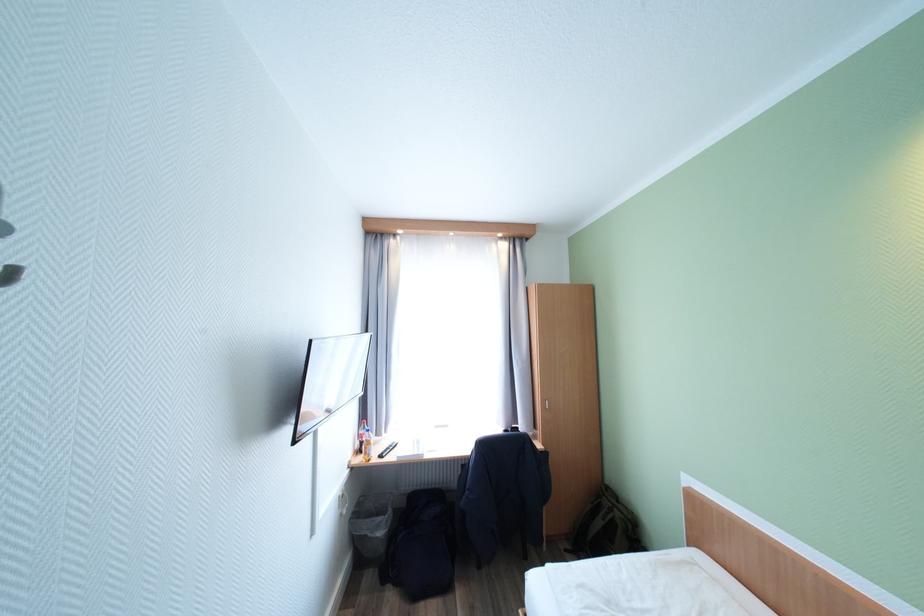
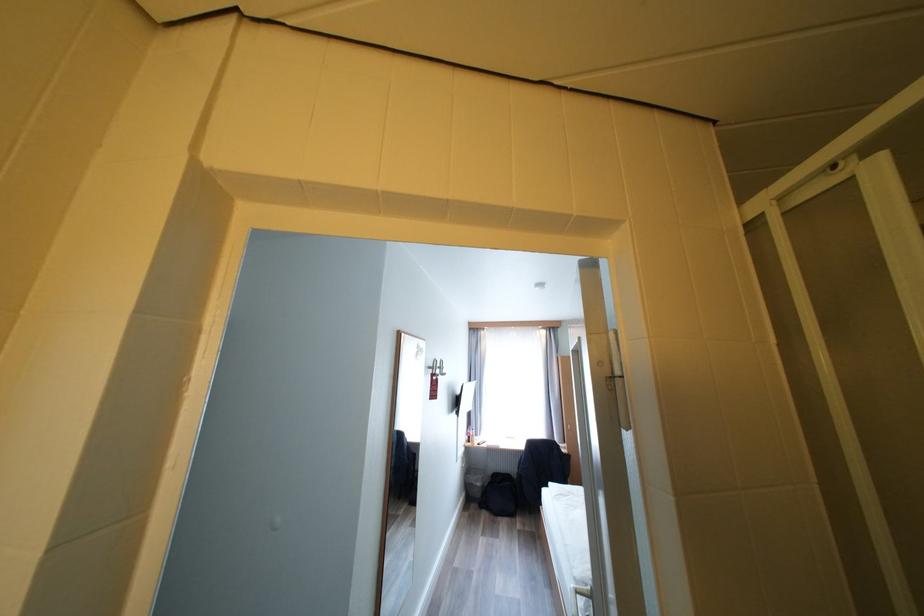
Find the pixel in the second image that matches the point at 387,535 in the first image.

(485, 485)